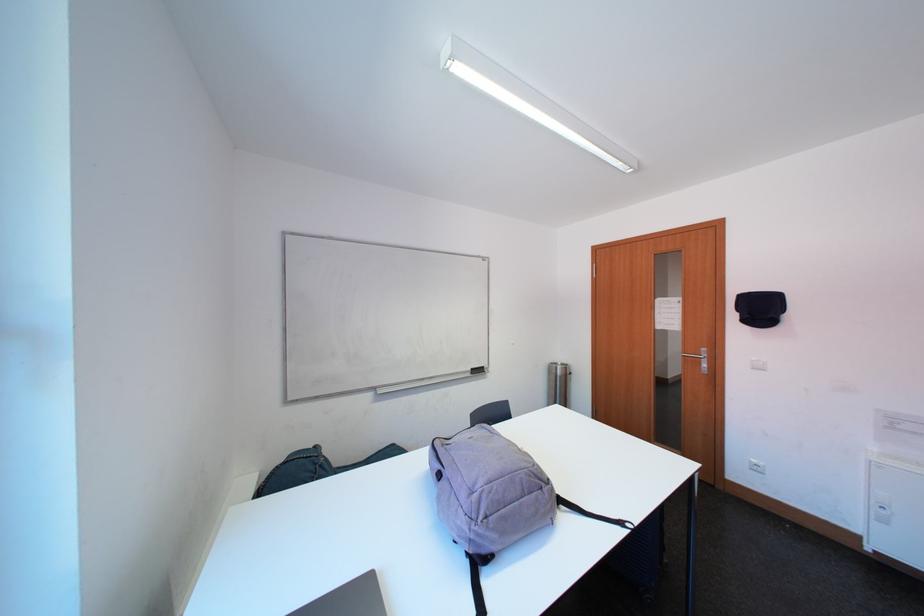
Locate an element on the screen. The height and width of the screenshot is (616, 924). white light switch is located at coordinates (758, 363).